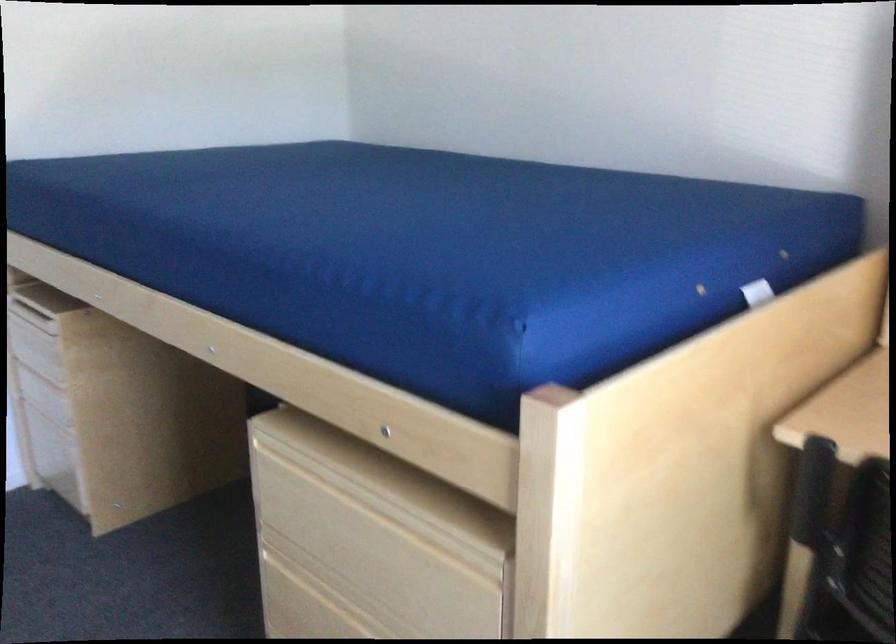
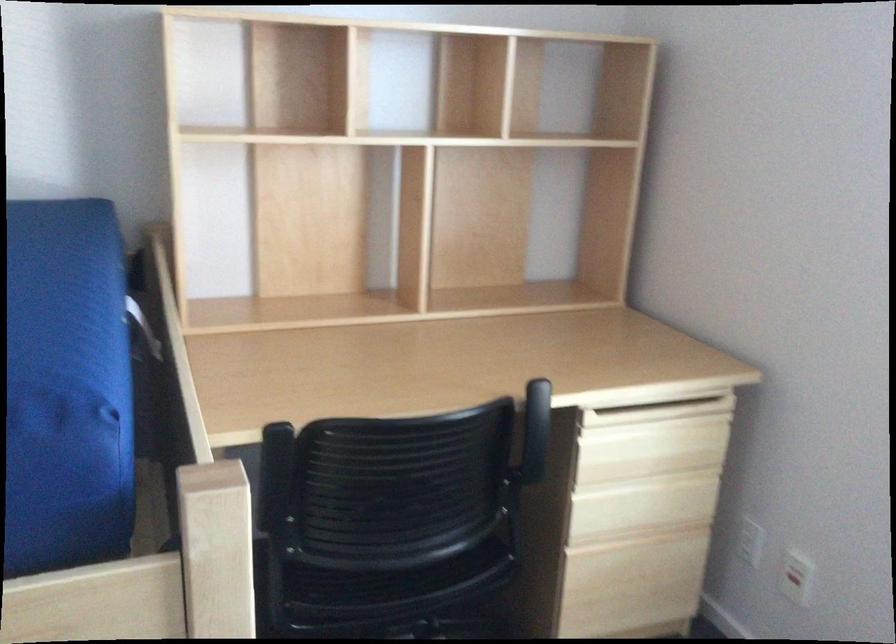
Find the pixel in the second image that matches the point at 514,301 in the first image.

(66, 388)